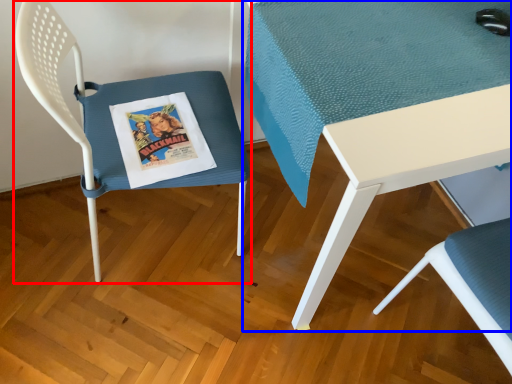
Question: Which object appears closest to the camera in this image, chair (highlighted by a red box) or table (highlighted by a blue box)?

Choices:
 (A) chair
 (B) table

Answer: (A)